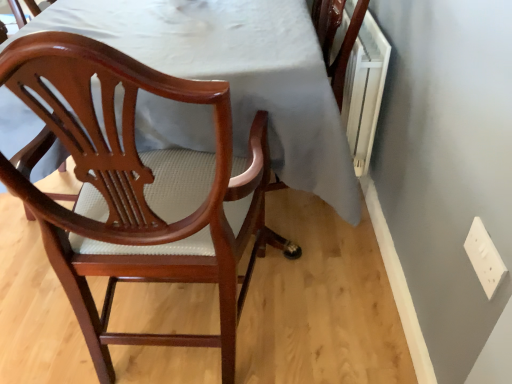
Question: Does point (504, 273) appear closer or farther from the camera than point (89, 142)?

Choices:
 (A) closer
 (B) farther

Answer: (B)

Question: Looking at the image, does white plastic electric outlet at lower right seem bigger or smaller compared to mahogany wood chair at left?

Choices:
 (A) small
 (B) big

Answer: (A)

Question: In terms of width, does white plastic electric outlet at lower right look wider or thinner when compared to mahogany wood chair at left?

Choices:
 (A) thin
 (B) wide

Answer: (A)

Question: Is point (188, 259) closer or farther from the camera than point (497, 271)?

Choices:
 (A) farther
 (B) closer

Answer: (A)

Question: Is mahogany wood chair at left inside the boundaries of white plastic electric outlet at lower right, or outside?

Choices:
 (A) inside
 (B) outside

Answer: (B)

Question: From a real-world perspective, relative to white plastic electric outlet at lower right, is mahogany wood chair at left vertically above or below?

Choices:
 (A) below
 (B) above

Answer: (A)

Question: Considering the positions of mahogany wood chair at left and white plastic electric outlet at lower right in the image, is mahogany wood chair at left wider or thinner than white plastic electric outlet at lower right?

Choices:
 (A) thin
 (B) wide

Answer: (B)